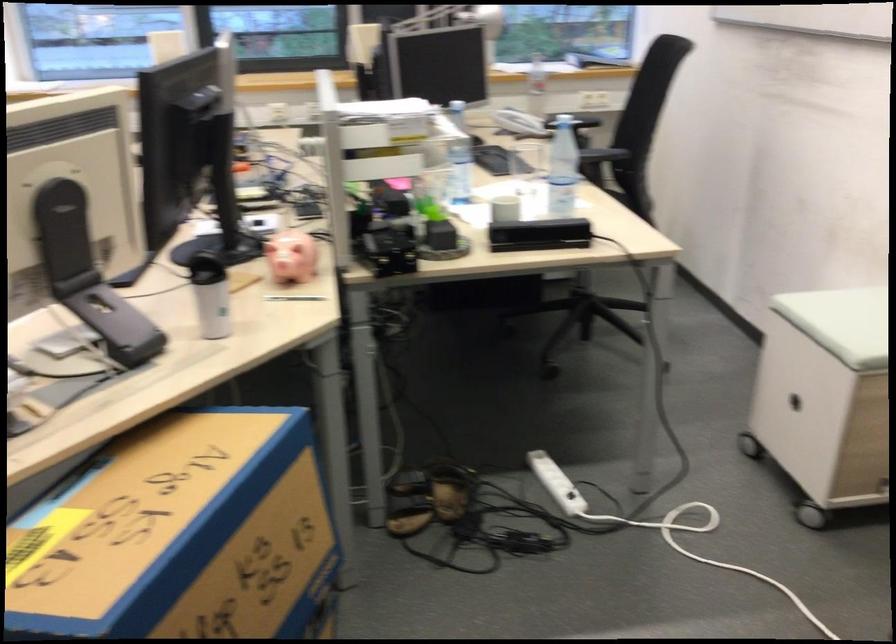
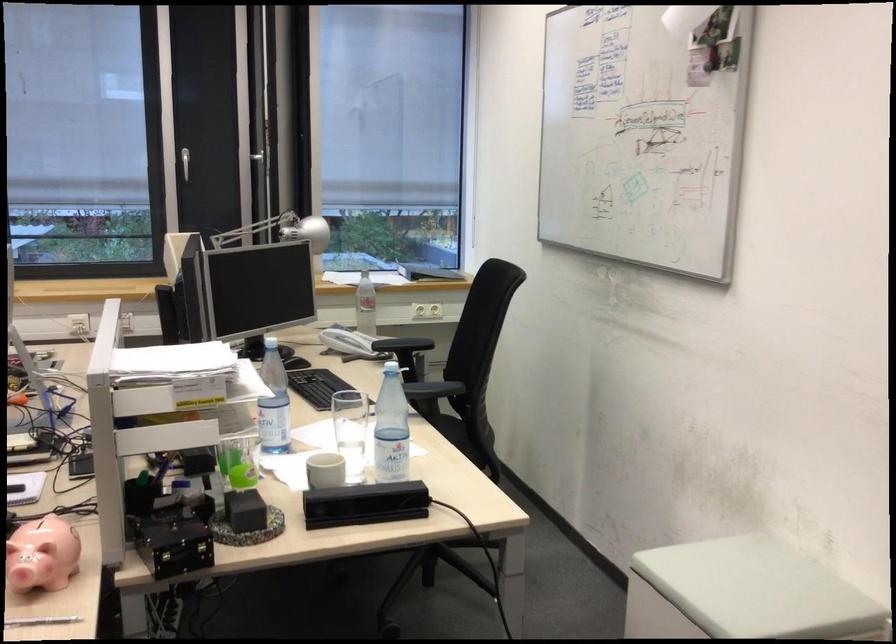
Question: What movement of the cameraman would produce the second image?

Choices:
 (A) Left
 (B) Right
 (C) Forward
 (D) Backward

Answer: (C)